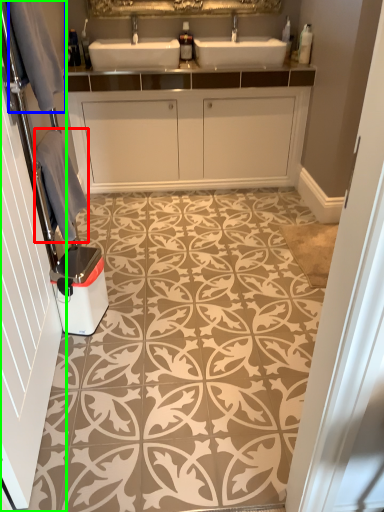
Question: Which is nearer to the material (highlighted by a red box)? gray (highlighted by a blue box) or door (highlighted by a green box).

Choices:
 (A) gray
 (B) door

Answer: (A)